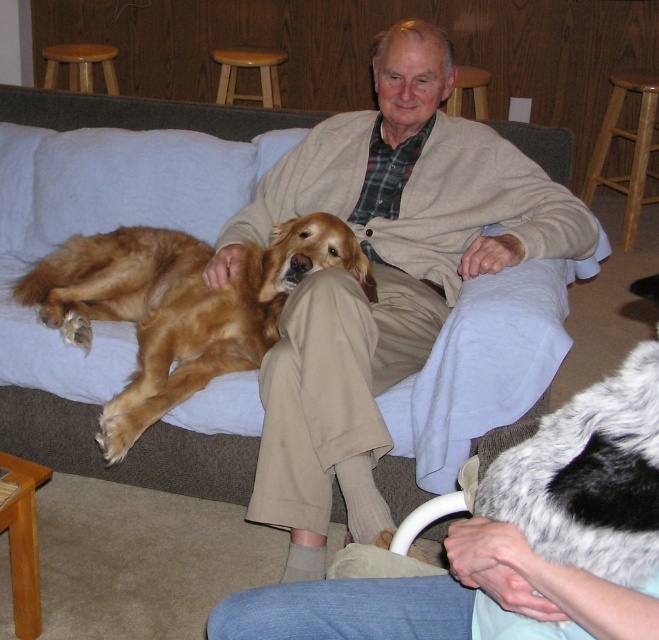
You are designing a new pet bed for the golden retriever in the image. The bed needs to be placed where the gray and white fur at lower right currently is. Considering the space available, will the new bed fit if it is the same size as the wooden stool at upper center?

The gray and white fur at lower right has a width less than the wooden stool at upper center, so the new bed, if the same size as the wooden stool at upper center, would not fit in the space where the gray and white fur at lower right is located.

Based on the photo, you are a guest in this living room and want to sit down. You see the gray and white fur at lower right and the wooden stool at upper center. Which one is more suitable for sitting?

The wooden stool at upper center is more suitable for sitting because it has a larger size compared to the gray and white fur at lower right, which is smaller and likely part of the dog or the man.

Based on the scene description, where exactly is the golden fur dog at center located in terms of coordinates?

The golden fur dog at center is located at point coordinates of [179,307].